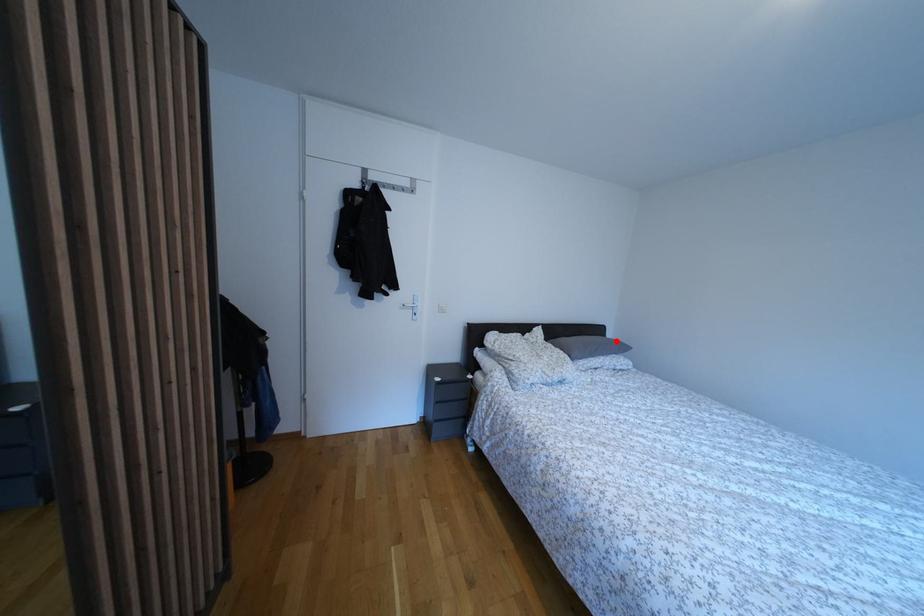
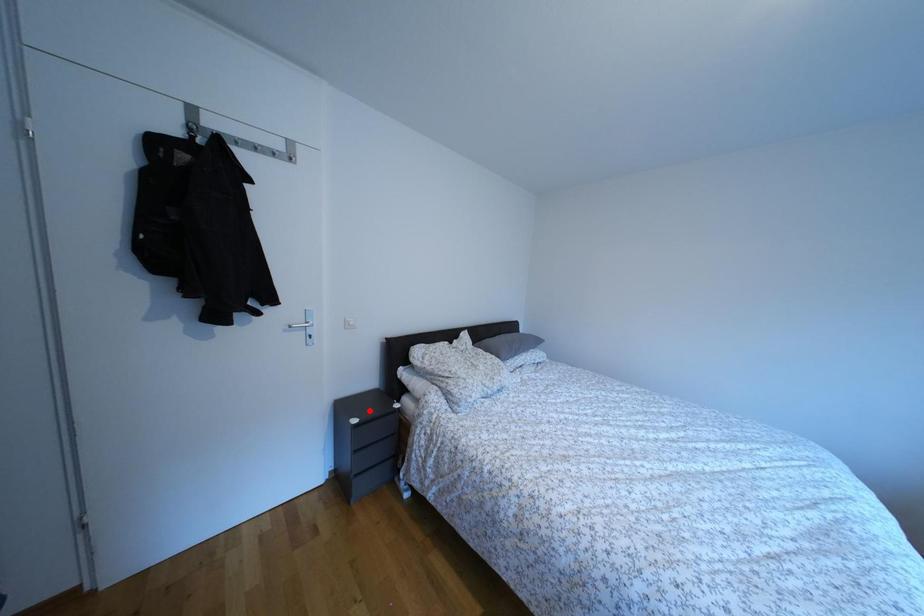
I am providing you with two images of the same scene from different viewpoints. A red point is marked on the first image and another point is marked on the second image. Is the red point in image1 aligned with the point shown in image2?

No